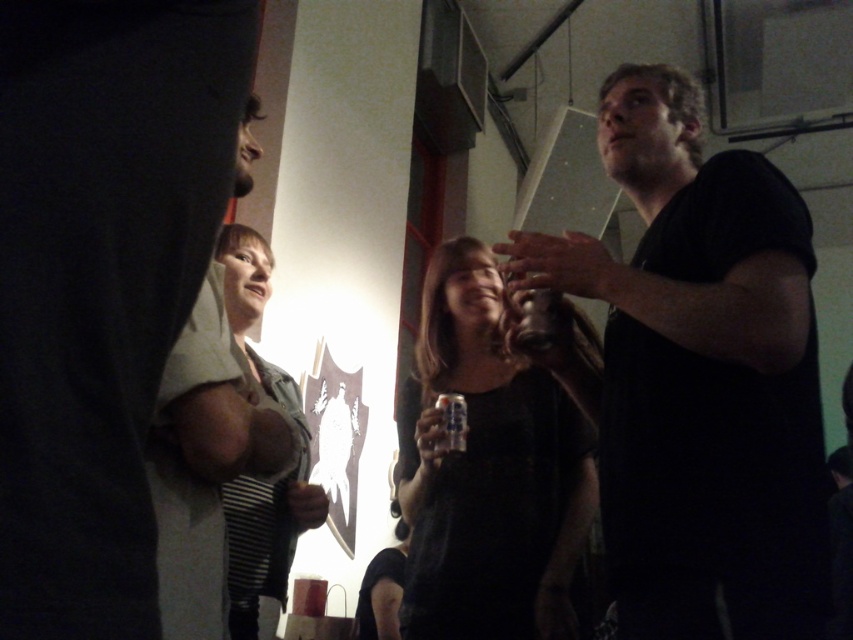
Question: Based on their relative distances, which object is nearer to the black matte shirt at upper right?

Choices:
 (A) clear plastic bottle at center
 (B) matte gray hoodie at left
 (C) metallic can at center

Answer: (C)

Question: Is striped fabric shirt at center smaller than clear plastic bottle at center?

Choices:
 (A) yes
 (B) no

Answer: (B)

Question: Which of the following is the closest to the observer?

Choices:
 (A) (248, 600)
 (B) (556, 628)
 (C) (554, 291)

Answer: (C)

Question: From the image, what is the correct spatial relationship of matte black can at center in relation to clear plastic bottle at center?

Choices:
 (A) left
 (B) right

Answer: (B)

Question: Is matte gray hoodie at left positioned at the back of striped fabric shirt at center?

Choices:
 (A) yes
 (B) no

Answer: (B)

Question: Estimate the real-world distances between objects in this image. Which object is farther from the clear plastic bottle at center?

Choices:
 (A) metallic can at center
 (B) matte black can at center
 (C) matte gray hoodie at left
 (D) striped fabric shirt at center

Answer: (D)